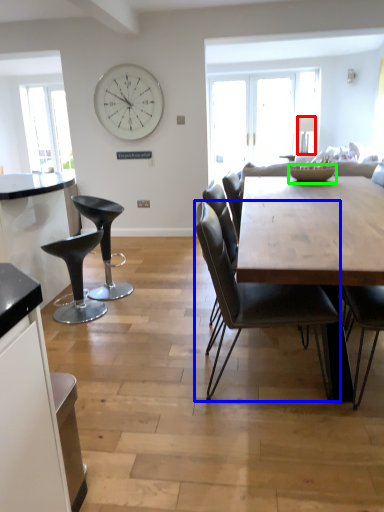
Question: Based on their relative distances, which object is nearer to lamp (highlighted by a red box)? Choose from chair (highlighted by a blue box) and bowl (highlighted by a green box).

Choices:
 (A) chair
 (B) bowl

Answer: (B)